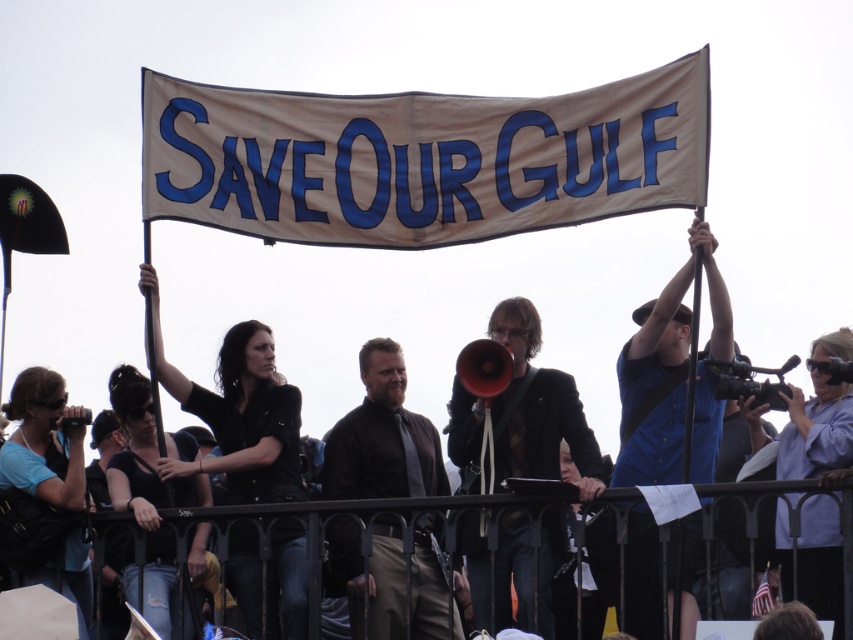
You are a photographer at the protest scene. You need to capture a photo of the large banner held by two individuals. However, there is an object at point [45,492] that might block your view. What object is located at that point?

The blue fabric shirt at lower left is located at point [45,492].

You are a photographer at the protest scene. You need to capture a photo of both the brown leather jacket at center and the blue fabric shirt at lower left. Which clothing item will appear bigger in the photo?

The brown leather jacket at center will appear bigger in the photo because it is larger in size than the blue fabric shirt at lower left.

You are a photographer at the protest scene. You want to capture a photo of the banner and the person holding the megaphone. The banner is at point (260, 342) and the megaphone holder is at point (175, 433). Will the banner block the view of the megaphone holder in your photo?

Point (260, 342) is in front of point (175, 433), so the banner at point (260, 342) will block the view of the person holding the megaphone at point (175, 433) in the photo.